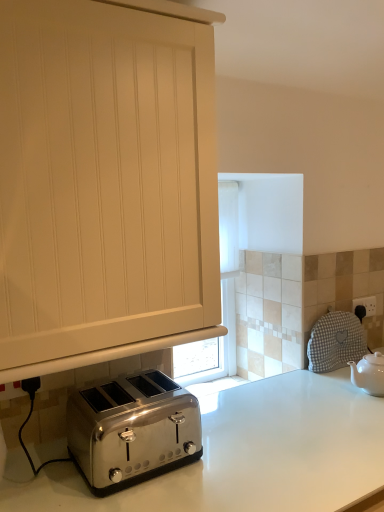
Where is `white glossy countertop at lower center`? Image resolution: width=384 pixels, height=512 pixels. white glossy countertop at lower center is located at coordinates (244, 454).

Where is `black plastic electric outlet at upper right`? black plastic electric outlet at upper right is located at coordinates (366, 305).

Describe the element at coordinates (132, 430) in the screenshot. I see `satin silver toaster at lower left` at that location.

Identify the location of white glossy countertop at lower center. (244, 454).

What's the angular difference between white wood cabinet at center and black plastic electric outlet at upper right's facing directions?

There is a 0.584-degree angle between the facing directions of white wood cabinet at center and black plastic electric outlet at upper right.

Is white wood cabinet at center further to camera compared to black plastic electric outlet at upper right?

No.

From the image's perspective, which is above, white wood cabinet at center or black plastic electric outlet at upper right?

white wood cabinet at center is shown above in the image.

From the picture: Is black plastic electric outlet at upper right inside satin silver toaster at lower left?

No, black plastic electric outlet at upper right is not surrounded by satin silver toaster at lower left.

Between satin silver toaster at lower left and black plastic electric outlet at upper right, which one appears on the left side from the viewer's perspective?

From the viewer's perspective, satin silver toaster at lower left appears more on the left side.

Which is behind, satin silver toaster at lower left or black plastic electric outlet at upper right?

black plastic electric outlet at upper right is further from the camera.

From the image's perspective, which object appears higher, satin silver toaster at lower left or black plastic electric outlet at upper right?

black plastic electric outlet at upper right, from the image's perspective.

From the image's perspective, is black plastic electric outlet at upper right positioned above or below white ceramic teapot at right?

black plastic electric outlet at upper right is above white ceramic teapot at right.

Is black plastic electric outlet at upper right directly adjacent to white ceramic teapot at right?

black plastic electric outlet at upper right is not next to white ceramic teapot at right, and they're not touching.

Can you confirm if black plastic electric outlet at upper right is wider than white ceramic teapot at right?

In fact, black plastic electric outlet at upper right might be narrower than white ceramic teapot at right.

Looking at this image, is black plastic electric outlet at upper right to the right of white ceramic teapot at right from the viewer's perspective?

Yes, black plastic electric outlet at upper right is to the right of white ceramic teapot at right.

Which is behind, white glossy countertop at lower center or white wood cabinet at center?

white wood cabinet at center.

The height and width of the screenshot is (512, 384). In order to click on countertop that is on the right side of white wood cabinet at center in this screenshot , I will do `click(244, 454)`.

Which of these two, white glossy countertop at lower center or white wood cabinet at center, is thinner?

white wood cabinet at center is thinner.

Is white glossy countertop at lower center positioned with its back to white wood cabinet at center?

That's not correct — white glossy countertop at lower center is not looking away from white wood cabinet at center.

From their relative heights in the image, would you say white ceramic teapot at right is taller or shorter than black plastic electric outlet at upper right?

Considering their sizes, white ceramic teapot at right has more height than black plastic electric outlet at upper right.

From the image's perspective, does white ceramic teapot at right appear lower than black plastic electric outlet at upper right?

Indeed, from the image's perspective, white ceramic teapot at right is shown beneath black plastic electric outlet at upper right.

Based on the photo, which object is further away from the camera taking this photo, white ceramic teapot at right or black plastic electric outlet at upper right?

black plastic electric outlet at upper right.

Is point (377, 356) positioned in front of point (364, 305)?

That is True.

Can you confirm if white ceramic teapot at right is thinner than satin silver toaster at lower left?

Indeed, white ceramic teapot at right has a lesser width compared to satin silver toaster at lower left.

From a real-world perspective, which is physically above, white ceramic teapot at right or satin silver toaster at lower left?

satin silver toaster at lower left.

From the image's perspective, does white ceramic teapot at right appear lower than satin silver toaster at lower left?

No, from the image's perspective, white ceramic teapot at right is not beneath satin silver toaster at lower left.

Can you tell me how much satin silver toaster at lower left and white wood cabinet at center differ in facing direction?

1.47 degrees.

Where is `toaster that appears on the right of white wood cabinet at center`? Image resolution: width=384 pixels, height=512 pixels. toaster that appears on the right of white wood cabinet at center is located at coordinates (132, 430).

Is satin silver toaster at lower left positioned far away from white wood cabinet at center?

satin silver toaster at lower left is near white wood cabinet at center, not far away.

Is satin silver toaster at lower left aimed at white wood cabinet at center?

No, satin silver toaster at lower left does not turn towards white wood cabinet at center.

The height and width of the screenshot is (512, 384). I want to click on electric outlet behind the white wood cabinet at center, so click(366, 305).

This screenshot has height=512, width=384. What are the coordinates of `electric outlet above the satin silver toaster at lower left (from a real-world perspective)` in the screenshot? It's located at (366, 305).

When comparing their distances from black plastic electric outlet at upper right, does satin silver toaster at lower left or white ceramic teapot at right seem further?

satin silver toaster at lower left lies further to black plastic electric outlet at upper right than the other object.

Looking at this image, looking at the image, which one is located further to black plastic electric outlet at upper right, white glossy countertop at lower center or white ceramic teapot at right?

white glossy countertop at lower center is positioned further to the anchor black plastic electric outlet at upper right.

Estimate the real-world distances between objects in this image. Which object is further from white wood cabinet at center, white ceramic teapot at right or white glossy countertop at lower center?

white ceramic teapot at right is positioned further to the anchor white wood cabinet at center.

When comparing their distances from white ceramic teapot at right, does white glossy countertop at lower center or satin silver toaster at lower left seem closer?

white glossy countertop at lower center.

From the image, which object appears to be farther from white wood cabinet at center, satin silver toaster at lower left or white ceramic teapot at right?

white ceramic teapot at right.

Looking at this image, looking at the image, which one is located closer to white wood cabinet at center, white glossy countertop at lower center or black plastic electric outlet at upper right?

Among the two, white glossy countertop at lower center is located nearer to white wood cabinet at center.

Which object lies further to the anchor point black plastic electric outlet at upper right, white wood cabinet at center or white glossy countertop at lower center?

Among the two, white wood cabinet at center is located further to black plastic electric outlet at upper right.

Which object lies further to the anchor point satin silver toaster at lower left, black plastic electric outlet at upper right or white ceramic teapot at right?

The object further to satin silver toaster at lower left is black plastic electric outlet at upper right.

Locate an element on the screen. This screenshot has width=384, height=512. countertop between satin silver toaster at lower left and white ceramic teapot at right in the horizontal direction is located at coordinates (244, 454).

Identify the location of toaster between white wood cabinet at center and white glossy countertop at lower center vertically. This screenshot has width=384, height=512. (132, 430).

This screenshot has width=384, height=512. In order to click on tea pot located between white wood cabinet at center and black plastic electric outlet at upper right in the depth direction in this screenshot , I will do `click(369, 373)`.

Locate an element on the screen. The height and width of the screenshot is (512, 384). tea pot between white wood cabinet at center and white glossy countertop at lower center vertically is located at coordinates (369, 373).